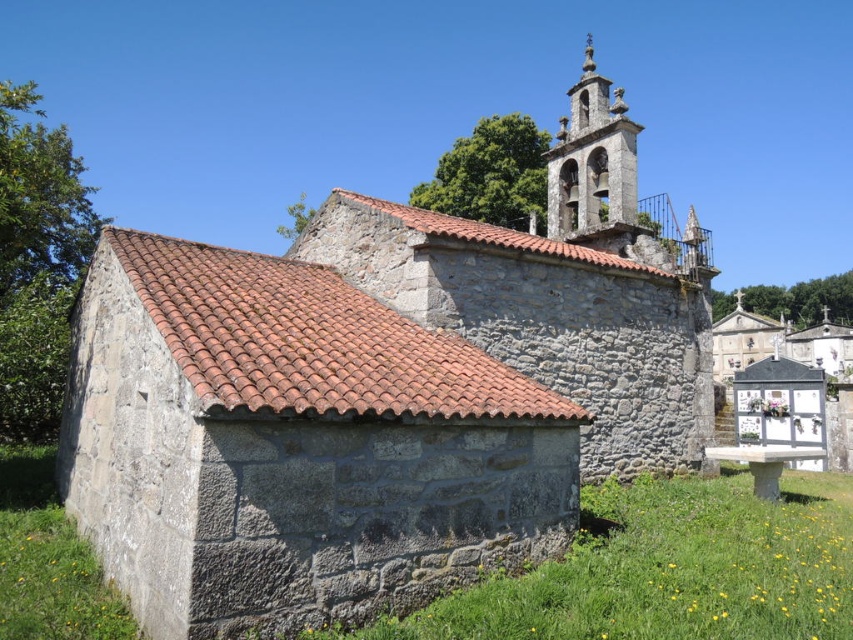
You are standing in the middle of a field facing the rustic stone chapel at center and the stone bell tower at upper right. Which structure is positioned to your left?

The rustic stone chapel at center is to the left of the stone bell tower at upper right, so when facing both structures, the rustic stone chapel at center will be on your left side.

You are a tourist visiting the church and want to take a photo that includes both the rustic stone chapel at center and the brown tile roof at upper left. Which object should you position closer to the camera to ensure both are fully visible in the frame?

The rustic stone chapel at center is much taller than the brown tile roof at upper left, so you should position the camera closer to the brown tile roof at upper left to include both in the frame.

You are standing at the point marked as point [378,394]. What is the name of the building you are currently at?

You are currently at the rustic stone chapel at center, which is located at point [378,394].